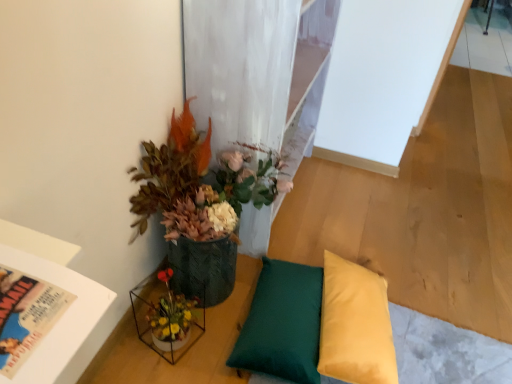
The width and height of the screenshot is (512, 384). I want to click on free point to the left of green fabric pillow at lower center, the 1th pillow when ordered from left to right, so click(x=197, y=330).